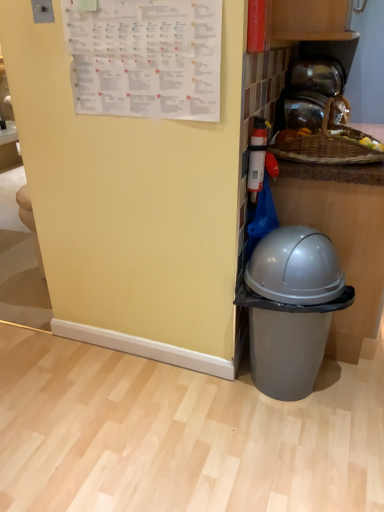
Question: Can you confirm if white paper calendar at upper left is wider than woven wood basket at upper right?

Choices:
 (A) no
 (B) yes

Answer: (A)

Question: Does white paper calendar at upper left have a lesser width compared to woven wood basket at upper right?

Choices:
 (A) no
 (B) yes

Answer: (B)

Question: Can we say white paper calendar at upper left lies outside woven wood basket at upper right?

Choices:
 (A) yes
 (B) no

Answer: (A)

Question: From a real-world perspective, is white paper calendar at upper left positioned under woven wood basket at upper right based on gravity?

Choices:
 (A) yes
 (B) no

Answer: (B)

Question: From the image's perspective, is white paper calendar at upper left located beneath woven wood basket at upper right?

Choices:
 (A) no
 (B) yes

Answer: (A)

Question: Is woven wood basket at upper right spatially inside white paper calendar at upper left, or outside of it?

Choices:
 (A) outside
 (B) inside

Answer: (A)

Question: Is point (329, 178) positioned closer to the camera than point (183, 4)?

Choices:
 (A) farther
 (B) closer

Answer: (A)

Question: Considering the positions of woven wood basket at upper right and white paper calendar at upper left in the image, is woven wood basket at upper right wider or thinner than white paper calendar at upper left?

Choices:
 (A) thin
 (B) wide

Answer: (B)

Question: From the image's perspective, is woven wood basket at upper right located above or below white paper calendar at upper left?

Choices:
 (A) below
 (B) above

Answer: (A)

Question: In terms of size, does transparent glass jar at upper right appear bigger or smaller than white paper calendar at upper left?

Choices:
 (A) big
 (B) small

Answer: (A)

Question: From the image's perspective, relative to white paper calendar at upper left, is transparent glass jar at upper right above or below?

Choices:
 (A) above
 (B) below

Answer: (A)

Question: Considering the relative positions of transparent glass jar at upper right and white paper calendar at upper left in the image provided, is transparent glass jar at upper right to the left or to the right of white paper calendar at upper left?

Choices:
 (A) right
 (B) left

Answer: (A)

Question: Considering their positions, is transparent glass jar at upper right located in front of or behind white paper calendar at upper left?

Choices:
 (A) front
 (B) behind

Answer: (B)

Question: From the image's perspective, is woven wood basket at upper right positioned above or below transparent glass jar at upper right?

Choices:
 (A) below
 (B) above

Answer: (A)

Question: Is woven wood basket at upper right bigger or smaller than transparent glass jar at upper right?

Choices:
 (A) small
 (B) big

Answer: (B)